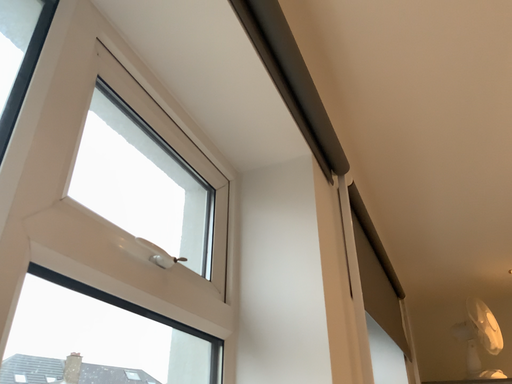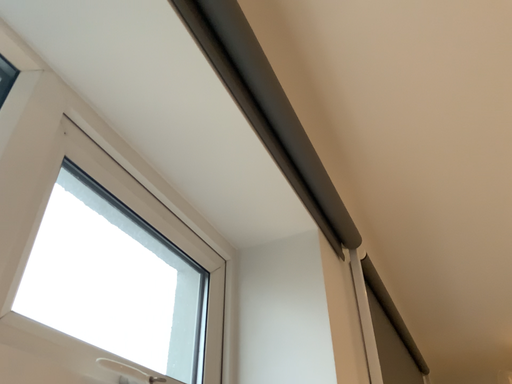
Question: How did the camera likely rotate when shooting the video?

Choices:
 (A) rotated upward
 (B) rotated downward

Answer: (A)